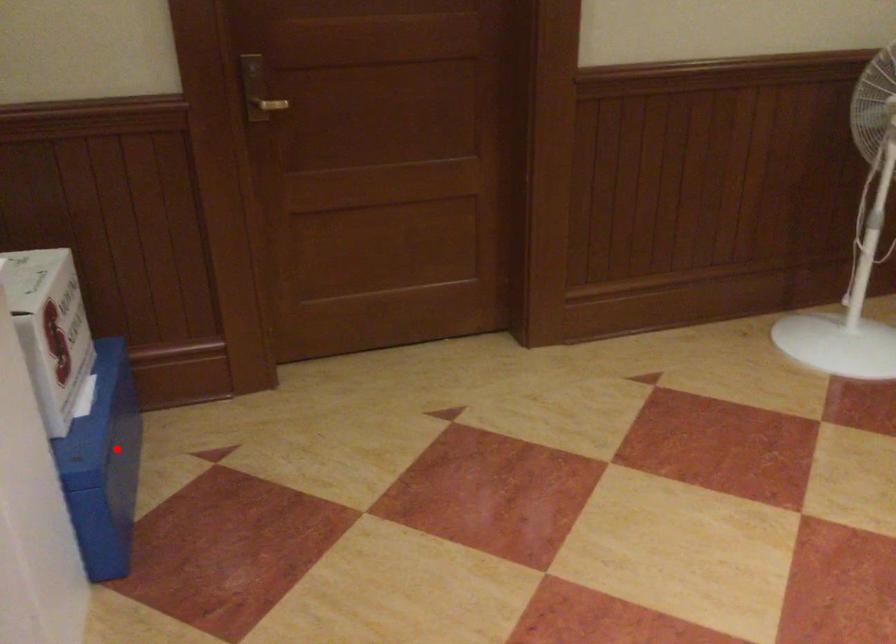
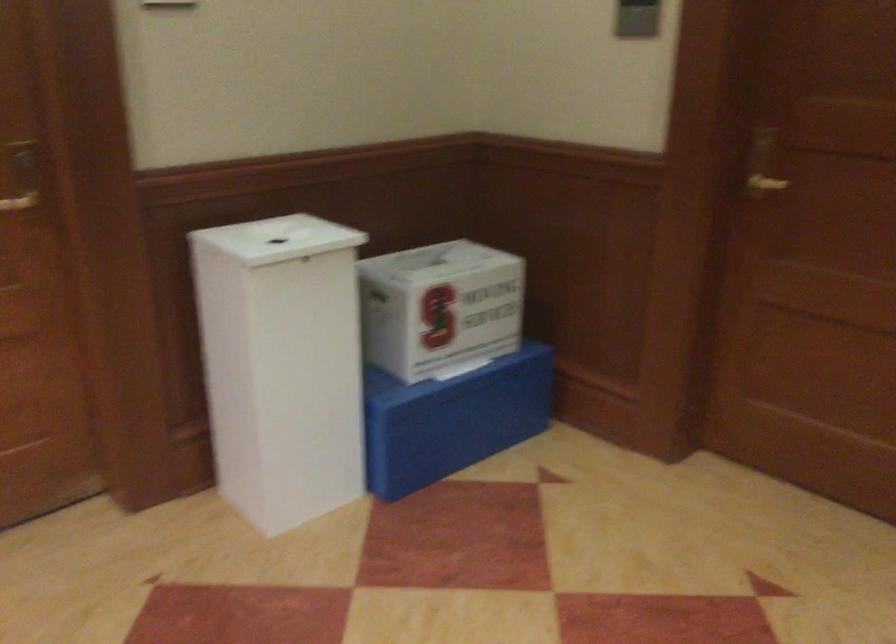
Find the pixel in the second image that matches the highlighted location in the first image.

(452, 419)